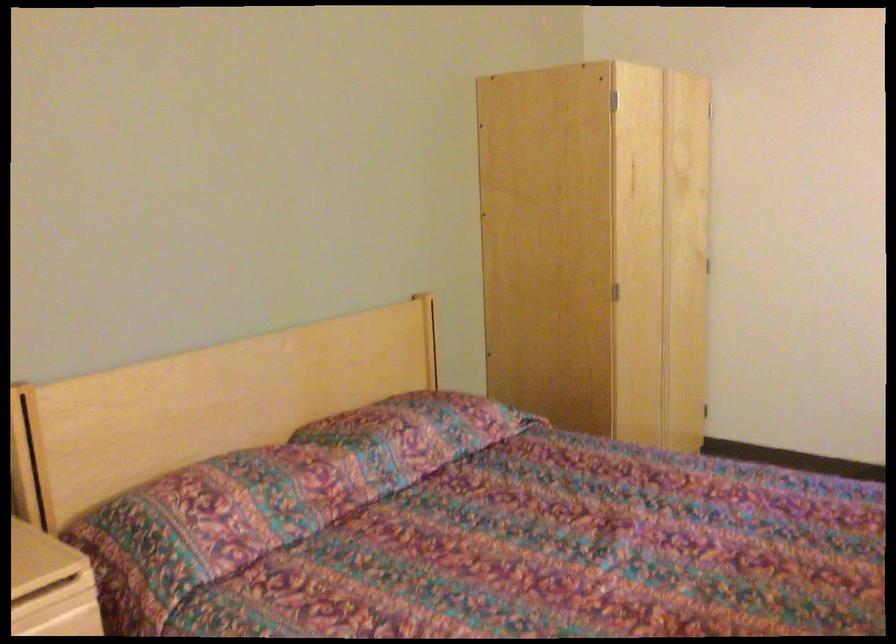
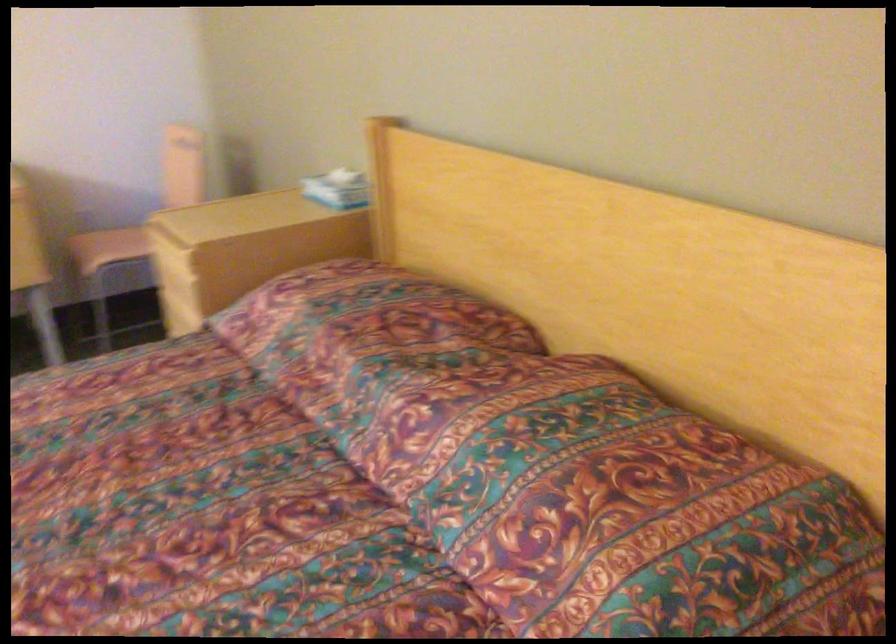
Where in the second image is the point corresponding to (300,462) from the first image?

(354, 325)